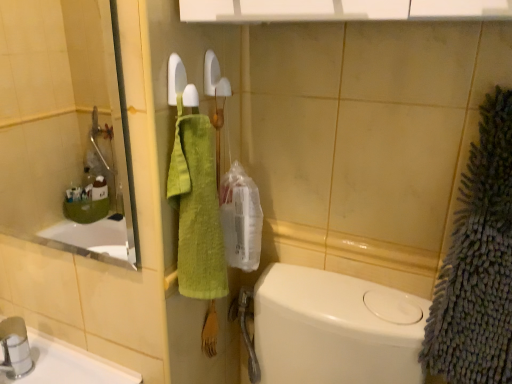
Question: Do you think green cotton towel at center, which appears as the 2th bath towel when viewed from the right, is within clear glass mirror at upper left, or outside of it?

Choices:
 (A) inside
 (B) outside

Answer: (B)

Question: Is point (198, 294) closer or farther from the camera than point (93, 87)?

Choices:
 (A) closer
 (B) farther

Answer: (A)

Question: Which of these objects is positioned closest to the green cotton towel at center, which appears as the 2th bath towel when viewed from the right?

Choices:
 (A) gray fuzzy bath towel at right, arranged as the first bath towel when viewed from the right
 (B) clear glass mirror at upper left

Answer: (A)

Question: Estimate the real-world distances between objects in this image. Which object is closer to the clear glass mirror at upper left?

Choices:
 (A) gray fuzzy bath towel at right, arranged as the first bath towel when viewed from the right
 (B) green cotton towel at center, which appears as the 2th bath towel when viewed from the right

Answer: (B)